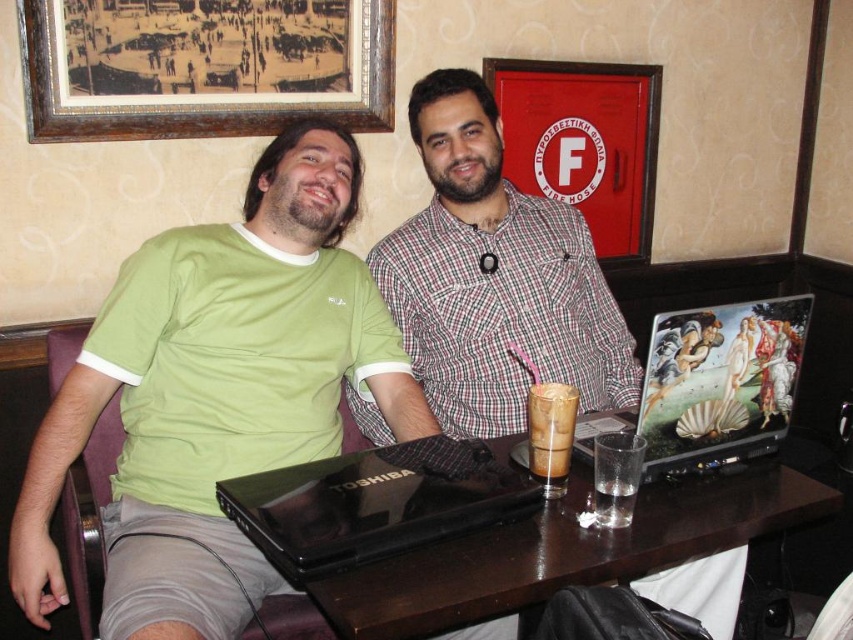
You are a photographer setting up for a group photo. You need to ensure that the plaid shirt at center and the red matte fire hose cabinet at upper center are both visible in the frame. Based on their positions, which object is closer to the camera and might require adjusting the focus or composition?

The plaid shirt at center is closer to the camera than the red matte fire hose cabinet at upper center because it is positioned at the center, while the cabinet is at upper center, which is further away. Adjust focus to ensure both are in frame.

You are a photographer taking a picture of the scene. You need to adjust your camera to focus on both the matte plaid shirt at center and the black glossy laptop at center. Which object should you focus on first to ensure both are in focus?

The matte plaid shirt at center is positioned on the right side of black glossy laptop at center. Since the shirt is further to the right, you should focus on the black glossy laptop at center first, then adjust to capture the matte plaid shirt at center in the same focal plane.

You are a photographer standing in front of the scene. You want to take a photo that includes both the plaid shirt at center and the wooden framed print at upper left. Which object should you focus on first to ensure both are in the frame?

The plaid shirt at center is located below the wooden framed print at upper left, so you should focus on the wooden framed print at upper left first to ensure both are in the frame.